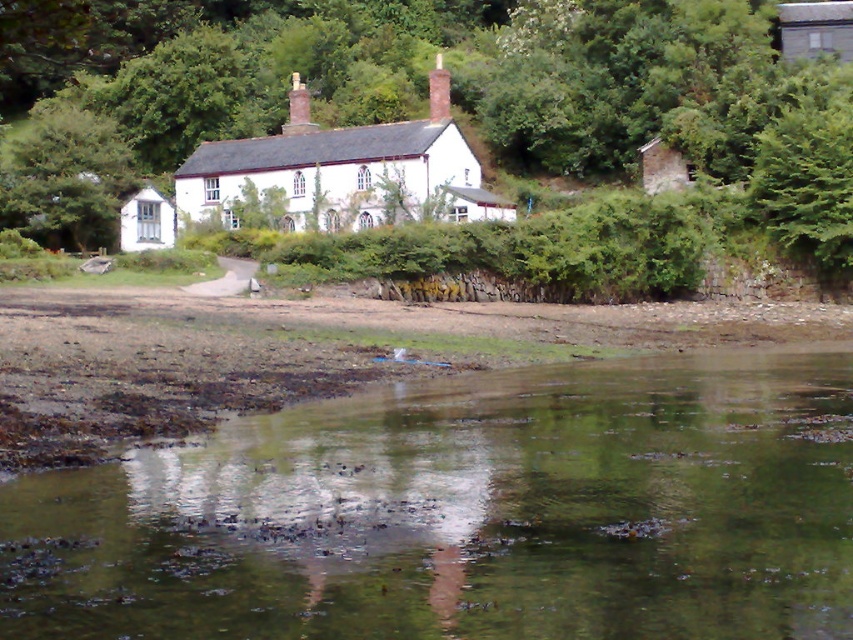
Question: Does white matte cottage at center have a smaller size compared to green leafy tree at upper left?

Choices:
 (A) yes
 (B) no

Answer: (B)

Question: Which point is closer to the camera?

Choices:
 (A) click(368, 150)
 (B) click(148, 188)

Answer: (A)

Question: Which of the following is the farthest from the observer?

Choices:
 (A) green leafy tree at upper center
 (B) green reflective water at lower center
 (C) white matte cottage at center
 (D) white matte cottage at left

Answer: (D)

Question: Can you confirm if green reflective water at lower center is bigger than green leafy tree at upper center?

Choices:
 (A) yes
 (B) no

Answer: (B)

Question: Based on their relative distances, which object is nearer to the green leafy tree at upper left?

Choices:
 (A) white matte cottage at center
 (B) green reflective water at lower center
 (C) white matte cottage at left
 (D) green leafy tree at upper center

Answer: (C)

Question: Does green reflective water at lower center have a lesser width compared to green leafy tree at upper center?

Choices:
 (A) no
 (B) yes

Answer: (B)